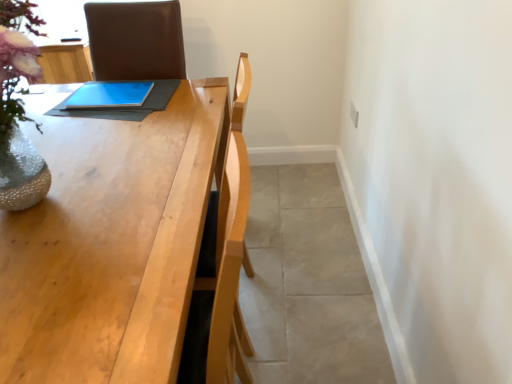
Question: Is light wood table at center closer to camera compared to gray tile floor at lower right?

Choices:
 (A) no
 (B) yes

Answer: (B)

Question: Can you confirm if light wood table at center is wider than gray tile floor at lower right?

Choices:
 (A) no
 (B) yes

Answer: (A)

Question: Is light wood table at center turned away from gray tile floor at lower right?

Choices:
 (A) yes
 (B) no

Answer: (B)

Question: From a real-world perspective, is light wood table at center located higher than gray tile floor at lower right?

Choices:
 (A) yes
 (B) no

Answer: (A)

Question: Considering the relative positions of light wood table at center and gray tile floor at lower right in the image provided, is light wood table at center to the left of gray tile floor at lower right from the viewer's perspective?

Choices:
 (A) yes
 (B) no

Answer: (A)

Question: Is light wood table at center facing towards gray tile floor at lower right?

Choices:
 (A) no
 (B) yes

Answer: (A)

Question: Is blue matte tablet at center closer to camera compared to gray tile floor at lower right?

Choices:
 (A) no
 (B) yes

Answer: (A)

Question: Is blue matte tablet at center next to gray tile floor at lower right and touching it?

Choices:
 (A) yes
 (B) no

Answer: (B)

Question: Is blue matte tablet at center to the left of gray tile floor at lower right from the viewer's perspective?

Choices:
 (A) no
 (B) yes

Answer: (B)

Question: Does blue matte tablet at center come behind gray tile floor at lower right?

Choices:
 (A) yes
 (B) no

Answer: (A)

Question: Does blue matte tablet at center have a lesser height compared to gray tile floor at lower right?

Choices:
 (A) no
 (B) yes

Answer: (B)

Question: Is blue matte tablet at center taller than gray tile floor at lower right?

Choices:
 (A) no
 (B) yes

Answer: (A)

Question: From a real-world perspective, is gray tile floor at lower right beneath light wood table at center?

Choices:
 (A) no
 (B) yes

Answer: (B)